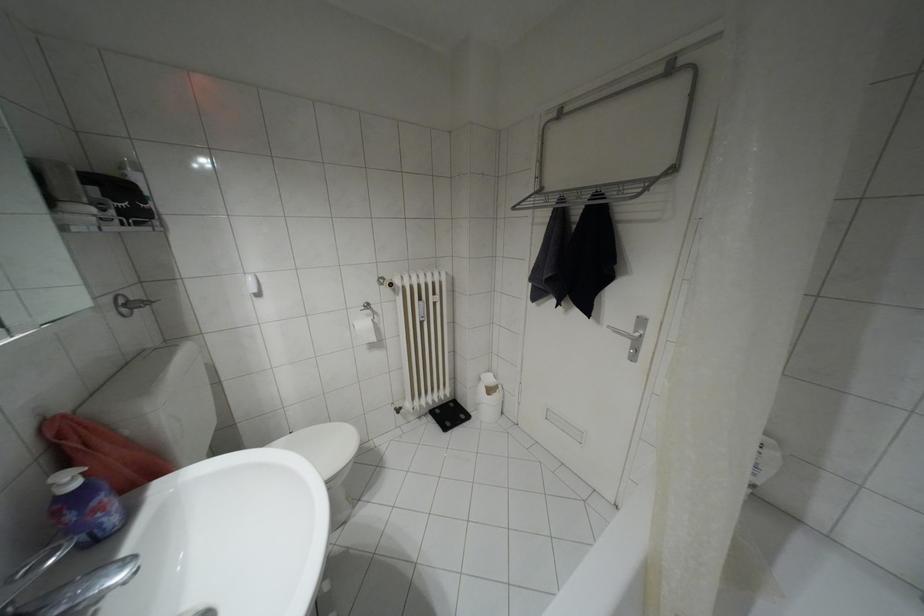
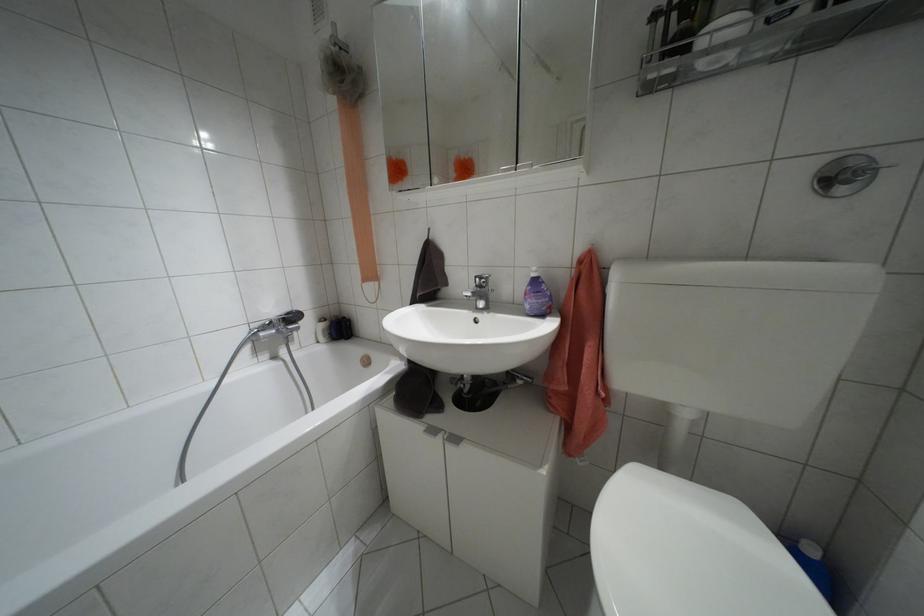
Where in the second image is the point corresponding to point 75,484 from the first image?

(532, 274)